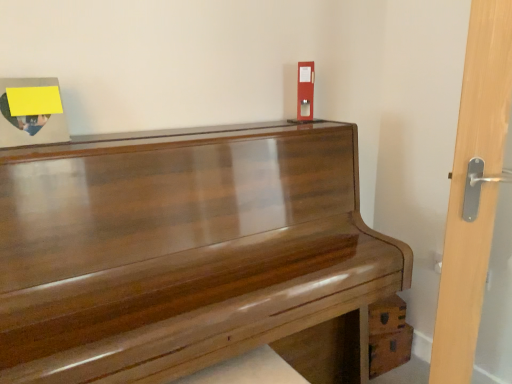
Measure the distance between glossy wood piano at center and camera.

glossy wood piano at center and camera are 31.49 inches apart from each other.

Describe the element at coordinates (189, 255) in the screenshot. The width and height of the screenshot is (512, 384). I see `glossy wood piano at center` at that location.

I want to click on glossy wood piano at center, so click(x=189, y=255).

Where is `glossy wood piano at center`? glossy wood piano at center is located at coordinates (189, 255).